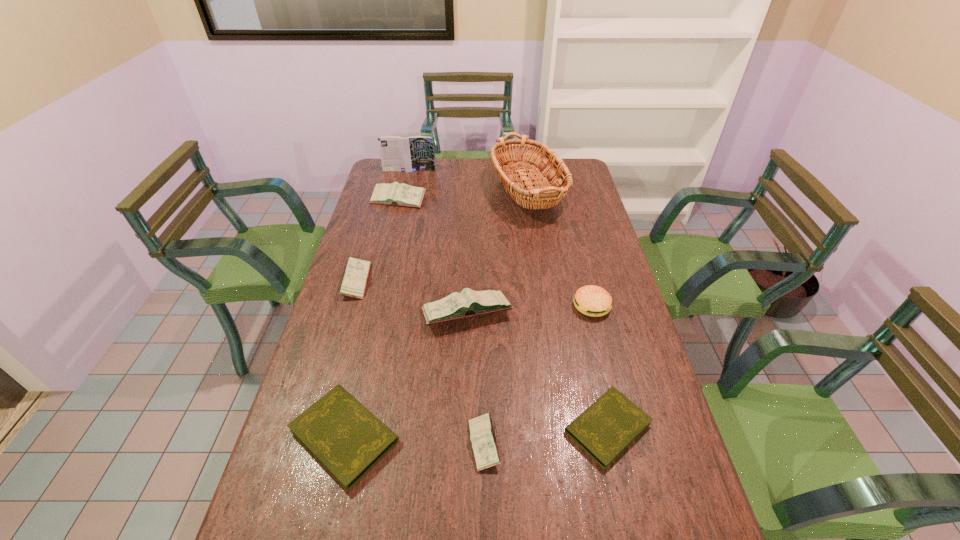
I want to click on the tallest object, so click(538, 194).

Find the location of a particular element. This screenshot has width=960, height=540. book is located at coordinates (415, 153).

At what (x,y) coordinates should I click in order to perform the action: click on the seventh shortest object. Please return your answer as a coordinate pair (x, y). Looking at the image, I should click on (469, 303).

Where is `the biggest pink diary`? the biggest pink diary is located at coordinates coord(469,303).

Find the location of a particular element. the farthest pink diary is located at coordinates (396, 194).

Where is `the third smallest pink diary`? This screenshot has width=960, height=540. the third smallest pink diary is located at coordinates click(x=396, y=194).

Image resolution: width=960 pixels, height=540 pixels. What are the coordinates of `brown patty` in the screenshot? It's located at (590, 300).

Where is `the fourth shortest diary`? The image size is (960, 540). the fourth shortest diary is located at coordinates (354, 281).

I want to click on the seventh tallest object, so click(482, 435).

The image size is (960, 540). Identify the location of the nearest pink diary. pos(482,435).